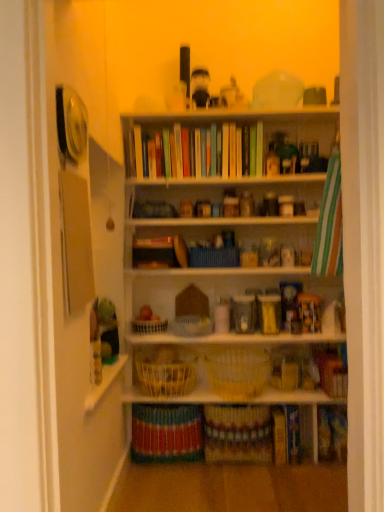
Question: From the image's perspective, is multicolored woven basket at lower center, acting as the third book starting from the right, on top of matte brown book at lower right, placed as the 3th book when sorted from left to right?

Choices:
 (A) no
 (B) yes

Answer: (A)

Question: Are multicolored woven basket at lower center, the first book when ordered from left to right, and matte brown book at lower right, placed as the 3th book when sorted from left to right, far apart?

Choices:
 (A) no
 (B) yes

Answer: (A)

Question: Considering the relative sizes of multicolored woven basket at lower center, the first book when ordered from left to right, and matte brown book at lower right, which is the first book from right to left, in the image provided, is multicolored woven basket at lower center, the first book when ordered from left to right, shorter than matte brown book at lower right, which is the first book from right to left,?

Choices:
 (A) no
 (B) yes

Answer: (A)

Question: Can you confirm if multicolored woven basket at lower center, the first book when ordered from left to right, is positioned to the right of matte brown book at lower right, which is the first book from right to left?

Choices:
 (A) no
 (B) yes

Answer: (A)

Question: Considering the relative sizes of multicolored woven basket at lower center, acting as the third book starting from the right, and matte brown book at lower right, which is the first book from right to left, in the image provided, is multicolored woven basket at lower center, acting as the third book starting from the right, taller than matte brown book at lower right, which is the first book from right to left,?

Choices:
 (A) yes
 (B) no

Answer: (A)

Question: From a real-world perspective, relative to white matte bookcase at center, is woven brown basket at center, which appears as the first basket when viewed from the top, vertically above or below?

Choices:
 (A) above
 (B) below

Answer: (B)

Question: Is woven brown basket at center, which appears as the first basket when viewed from the top, in front of or behind white matte bookcase at center in the image?

Choices:
 (A) behind
 (B) front

Answer: (A)

Question: Choose the correct answer: Is woven brown basket at center, which appears as the first basket when viewed from the top, inside white matte bookcase at center or outside it?

Choices:
 (A) inside
 (B) outside

Answer: (B)

Question: Considering the positions of woven brown basket at center, which appears as the first basket when viewed from the top, and white matte bookcase at center in the image, is woven brown basket at center, which appears as the first basket when viewed from the top, wider or thinner than white matte bookcase at center?

Choices:
 (A) thin
 (B) wide

Answer: (B)

Question: Considering their positions, is white woven basket at center, which is the third basket from top to bottom, located in front of or behind white woven basket at center, which is the fourth basket in bottom-to-top order?

Choices:
 (A) front
 (B) behind

Answer: (B)

Question: From their relative heights in the image, would you say white woven basket at center, which ranks as the 3th basket in bottom-to-top order, is taller or shorter than white woven basket at center, the 2th basket when ordered from top to bottom?

Choices:
 (A) tall
 (B) short

Answer: (B)

Question: Is white woven basket at center, which ranks as the 3th basket in bottom-to-top order, spatially inside white woven basket at center, which is the fourth basket in bottom-to-top order, or outside of it?

Choices:
 (A) outside
 (B) inside

Answer: (A)

Question: Considering the positions of white woven basket at center, which ranks as the 3th basket in bottom-to-top order, and white woven basket at center, the 2th basket when ordered from top to bottom, in the image, is white woven basket at center, which ranks as the 3th basket in bottom-to-top order, wider or thinner than white woven basket at center, the 2th basket when ordered from top to bottom,?

Choices:
 (A) wide
 (B) thin

Answer: (B)

Question: Relative to white woven basket at center, which is the fourth basket in bottom-to-top order, is woven brown basket at center, marked as the 5th basket in a bottom-to-top arrangement, in front or behind?

Choices:
 (A) behind
 (B) front

Answer: (A)

Question: From the image's perspective, is woven brown basket at center, which appears as the first basket when viewed from the top, positioned above or below white woven basket at center, which is the fourth basket in bottom-to-top order?

Choices:
 (A) above
 (B) below

Answer: (A)